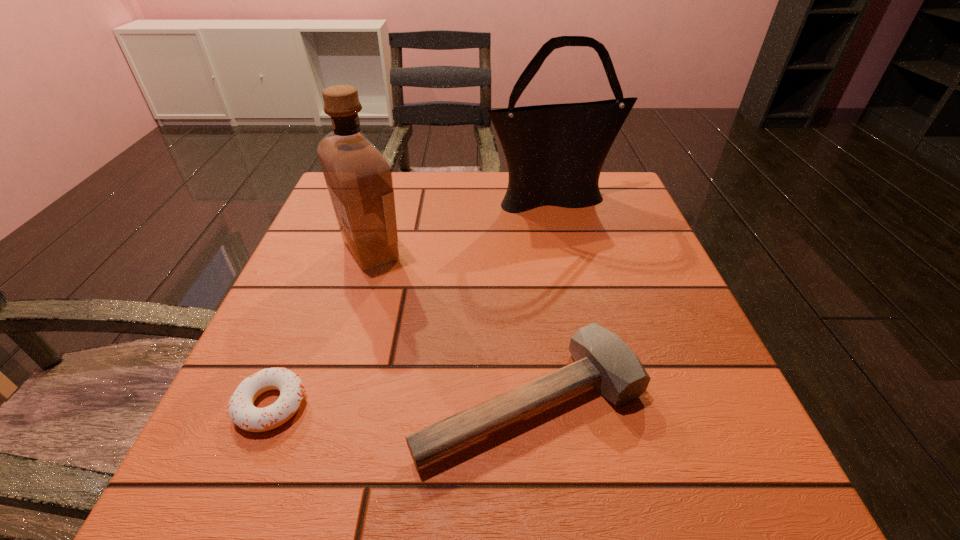
You are a GUI agent. You are given a task and a screenshot of the screen. Output one action in this format:
    pyautogui.click(x=<x>, y=<y>)
    Task: Click on the free space between the third nearest object and the shortest object
    The height and width of the screenshot is (540, 960).
    Given the screenshot: What is the action you would take?
    pyautogui.click(x=321, y=328)

Find the location of a particular element. free space between the doughnut and the third nearest object is located at coordinates click(321, 328).

You are a GUI agent. You are given a task and a screenshot of the screen. Output one action in this format:
    pyautogui.click(x=<x>, y=<y>)
    Task: Click on the free area in between the shoulder bag and the shortest object
    The width and height of the screenshot is (960, 540).
    Given the screenshot: What is the action you would take?
    pyautogui.click(x=413, y=301)

Identify the location of object that is the second closest to the doughnut. Image resolution: width=960 pixels, height=540 pixels. (358, 176).

In order to click on object that can be found as the closest to the third nearest object in this screenshot , I will do `click(602, 360)`.

I want to click on vacant space that satisfies the following two spatial constraints: 1. on the back side of the mallet; 2. on the front-facing side of the liquor, so click(516, 251).

Where is `blank area in the image that satisfies the following two spatial constraints: 1. on the back side of the second shortest object; 2. on the left side of the shoulder bag`? This screenshot has height=540, width=960. blank area in the image that satisfies the following two spatial constraints: 1. on the back side of the second shortest object; 2. on the left side of the shoulder bag is located at coordinates (510, 198).

Find the location of a particular element. The image size is (960, 540). vacant region that satisfies the following two spatial constraints: 1. on the back side of the shortest object; 2. on the right side of the second shortest object is located at coordinates (273, 401).

This screenshot has width=960, height=540. What are the coordinates of `vacant region that satisfies the following two spatial constraints: 1. on the front-facing side of the third tallest object; 2. on the right side of the liquor` in the screenshot? It's located at (325, 401).